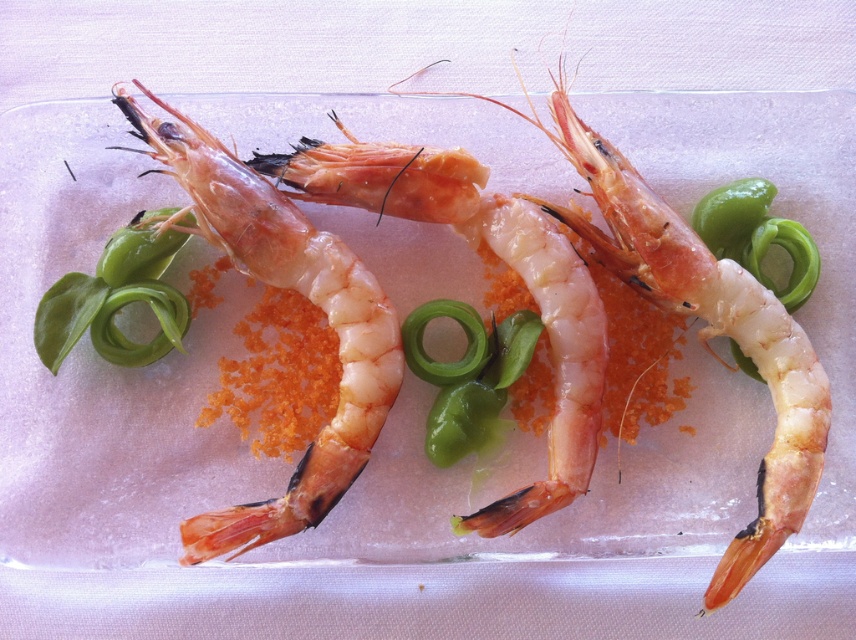
You are a food preparer and need to determine if the pinkish translucent shrimp at center can fit through a narrow opening that the green rubber band at center can pass through. Based on their widths, what is your conclusion?

The pinkish translucent shrimp at center is wider than the green rubber band at center, so it cannot fit through the narrow opening that the green rubber band at center can pass through.

You are a food critic inspecting a dish of prawns. You notice the pink translucent shrimp at center and the green glossy vegetable at upper left. Which one has a greater width?

The pink translucent shrimp at center might be wider than green glossy vegetable at upper left.